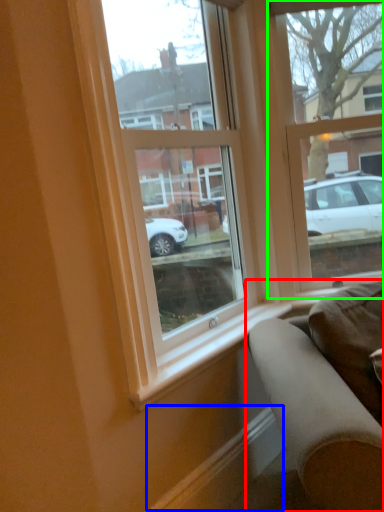
Question: Which object is positioned farthest from studio couch (highlighted by a red box)? Select from curb (highlighted by a blue box) and window (highlighted by a green box).

Choices:
 (A) curb
 (B) window

Answer: (B)